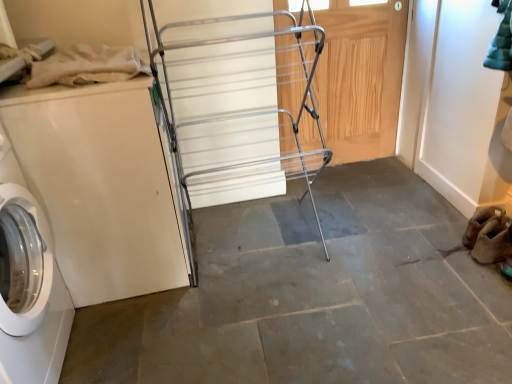
Question: Is white glossy washing machine at left not within silver metallic drying rack at center?

Choices:
 (A) no
 (B) yes

Answer: (B)

Question: Does white glossy washing machine at left have a smaller size compared to silver metallic drying rack at center?

Choices:
 (A) yes
 (B) no

Answer: (A)

Question: Considering the relative sizes of white glossy washing machine at left and silver metallic drying rack at center in the image provided, is white glossy washing machine at left wider than silver metallic drying rack at center?

Choices:
 (A) no
 (B) yes

Answer: (A)

Question: Considering the relative positions of white glossy washing machine at left and silver metallic drying rack at center in the image provided, is white glossy washing machine at left in front of silver metallic drying rack at center?

Choices:
 (A) no
 (B) yes

Answer: (A)

Question: Is silver metallic drying rack at center completely or partially inside white glossy washing machine at left?

Choices:
 (A) no
 (B) yes

Answer: (A)

Question: In the image, is silver metallic drying rack at center on the left side or the right side of white glossy washing machine at left?

Choices:
 (A) right
 (B) left

Answer: (A)

Question: In terms of width, does silver metallic drying rack at center look wider or thinner when compared to white glossy washing machine at left?

Choices:
 (A) wide
 (B) thin

Answer: (A)

Question: From the image's perspective, relative to white glossy washing machine at left, is silver metallic drying rack at center above or below?

Choices:
 (A) below
 (B) above

Answer: (B)

Question: Do you think silver metallic drying rack at center is within white glossy washing machine at left, or outside of it?

Choices:
 (A) outside
 (B) inside

Answer: (A)

Question: From the image's perspective, is silver metallic drying rack at center above or below wooden door at center?

Choices:
 (A) below
 (B) above

Answer: (A)

Question: Visually, is silver metallic drying rack at center positioned to the left or to the right of wooden door at center?

Choices:
 (A) left
 (B) right

Answer: (A)

Question: Looking at their shapes, would you say silver metallic drying rack at center is wider or thinner than wooden door at center?

Choices:
 (A) thin
 (B) wide

Answer: (B)

Question: From a real-world perspective, is silver metallic drying rack at center physically located above or below wooden door at center?

Choices:
 (A) above
 (B) below

Answer: (A)

Question: Considering the positions of wooden door at center and silver metallic drying rack at center in the image, is wooden door at center taller or shorter than silver metallic drying rack at center?

Choices:
 (A) short
 (B) tall

Answer: (A)

Question: Is wooden door at center wider or thinner than silver metallic drying rack at center?

Choices:
 (A) wide
 (B) thin

Answer: (B)